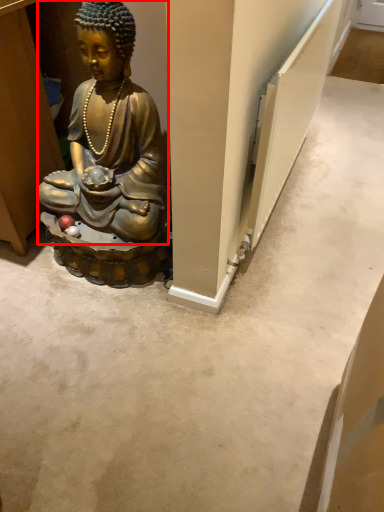
Question: From the image's perspective, where is person (annotated by the red box) located relative to radiator?

Choices:
 (A) below
 (B) above

Answer: (A)